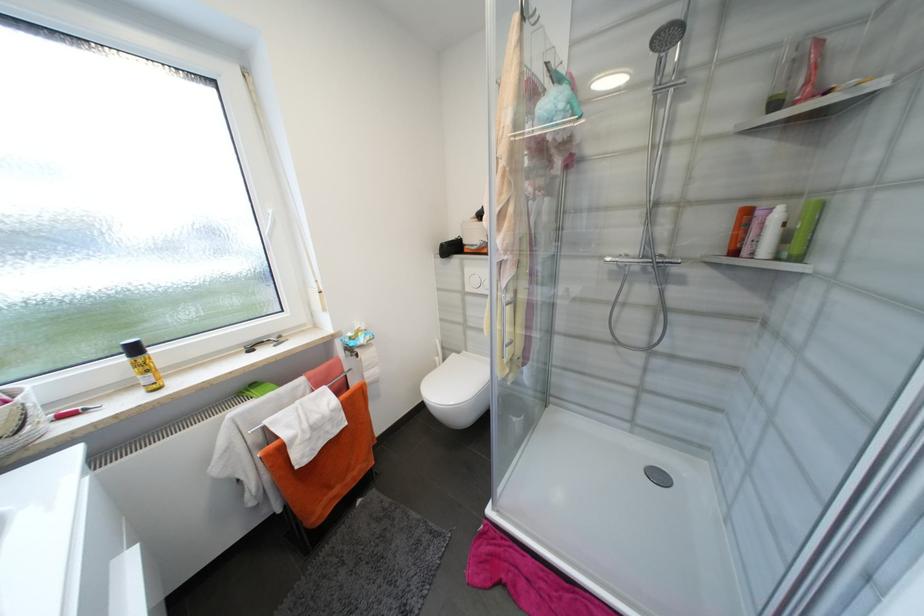
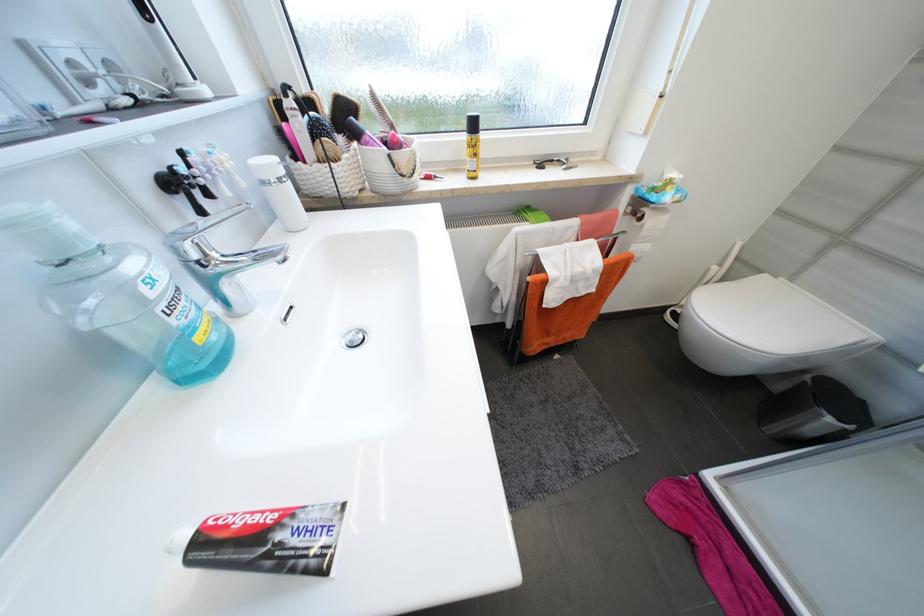
Find the pixel in the second image that matches point (362, 357) in the first image.

(647, 219)